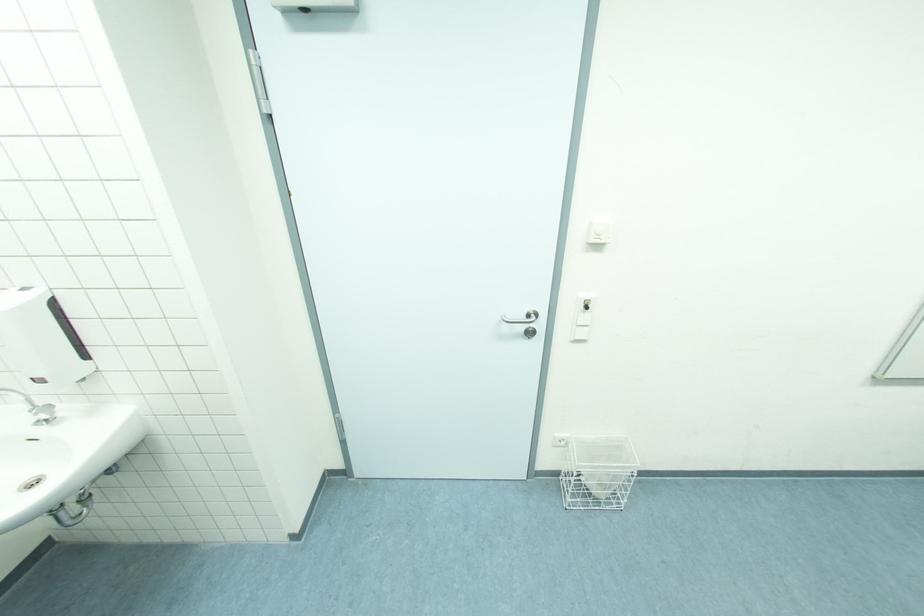
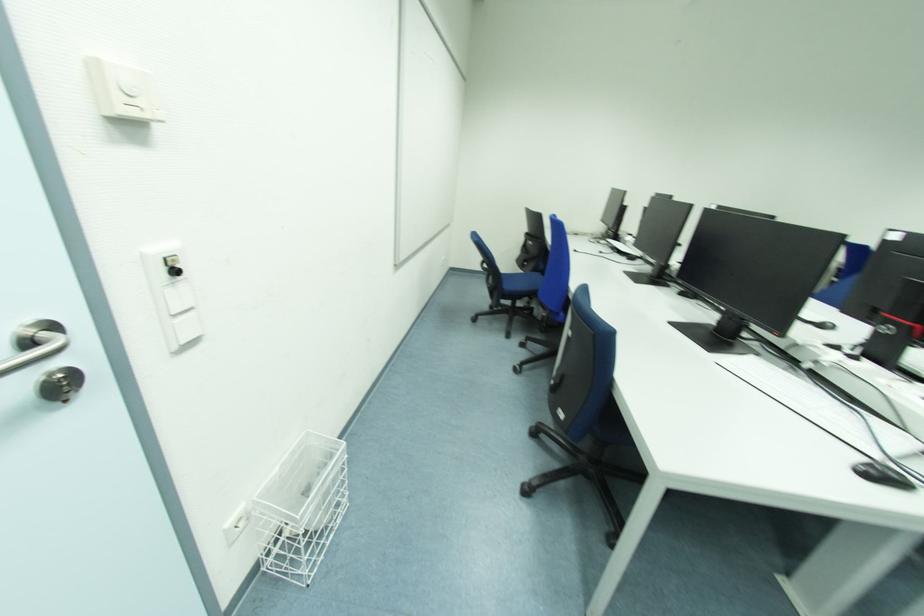
In the second image, find the point that corresponds to (x=580, y=326) in the first image.

(176, 314)